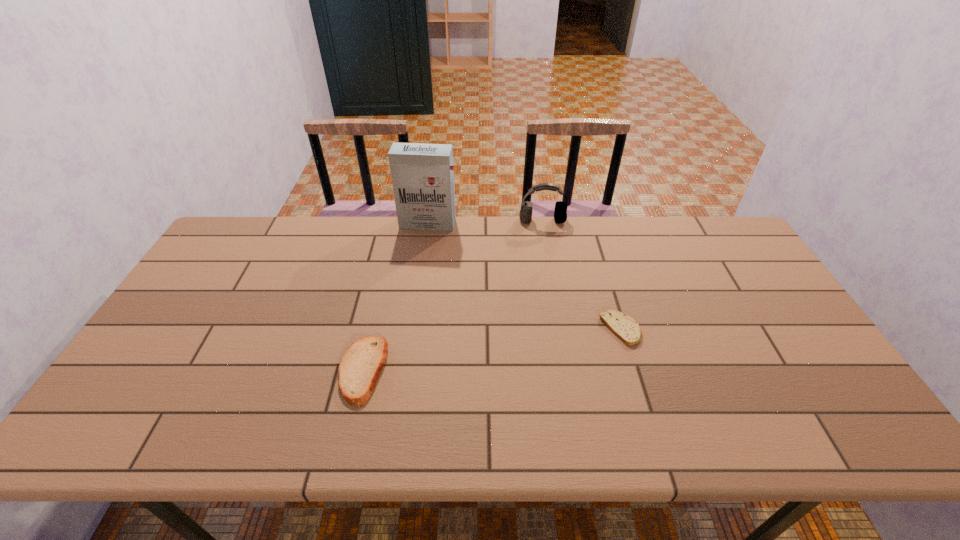
Locate which object is the closest to the rightmost object. Please provide its 2D coordinates. Your answer should be formatted as a tuple, i.e. [(x, y)], where the tuple contains the x and y coordinates of a point satisfying the conditions above.

[(560, 213)]

This screenshot has width=960, height=540. I want to click on free point that satisfies the following two spatial constraints: 1. on the front side of the right pita bread; 2. on the right side of the tallest object, so click(x=412, y=329).

At what (x,y) coordinates should I click in order to perform the action: click on blank space that satisfies the following two spatial constraints: 1. on the headband of the rightmost object; 2. on the right side of the second object from right to left. Please return your answer as a coordinate pair (x, y). The image size is (960, 540). Looking at the image, I should click on (562, 329).